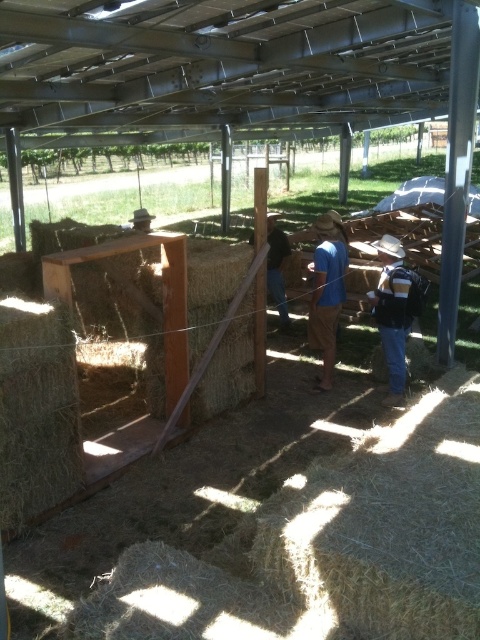
Is denim jacket at center wider than dark brown leather boots at center?

Indeed, denim jacket at center has a greater width compared to dark brown leather boots at center.

Between denim jacket at center and dark brown leather boots at center, which one has more height?

With more height is dark brown leather boots at center.

In order to click on denim jacket at center in this screenshot , I will do `click(392, 312)`.

Where is `denim jacket at center`? denim jacket at center is located at coordinates click(x=392, y=312).

Is point (403, 324) less distant than point (332, 232)?

That is True.

At what (x,y) coordinates should I click in order to perform the action: click on denim jacket at center. Please return your answer as a coordinate pair (x, y). The height and width of the screenshot is (640, 480). Looking at the image, I should click on (392, 312).

Does point (405, 298) lie in front of point (308, 268)?

Yes, it is in front of point (308, 268).

What are the coordinates of `denim jacket at center` in the screenshot? It's located at (392, 312).

Is blue cotton shirt at center above dark brown leather boots at center?

No, blue cotton shirt at center is not above dark brown leather boots at center.

Where is `blue cotton shirt at center`? blue cotton shirt at center is located at coordinates (326, 292).

I want to click on blue cotton shirt at center, so click(x=326, y=292).

Image resolution: width=480 pixels, height=640 pixels. Identify the location of blue cotton shirt at center. tap(326, 292).